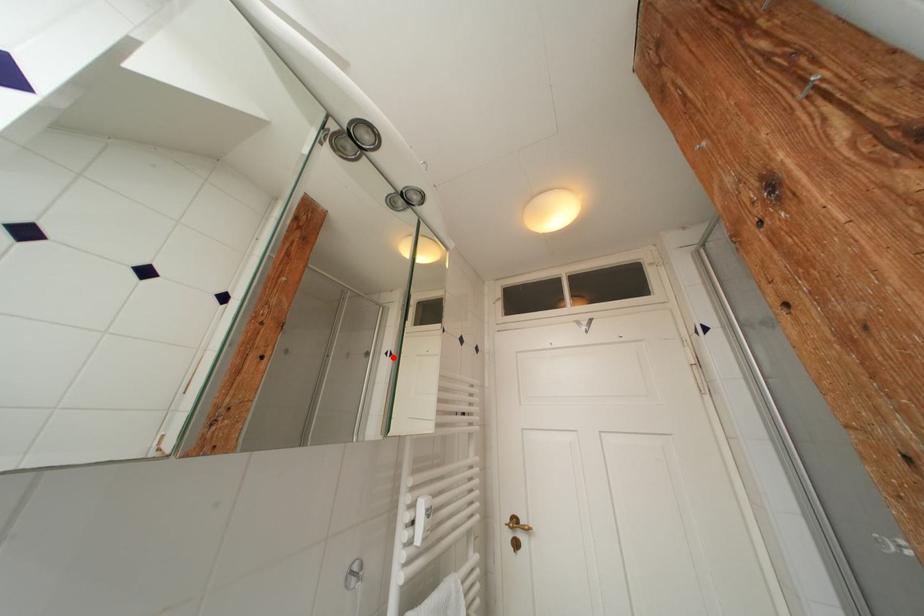
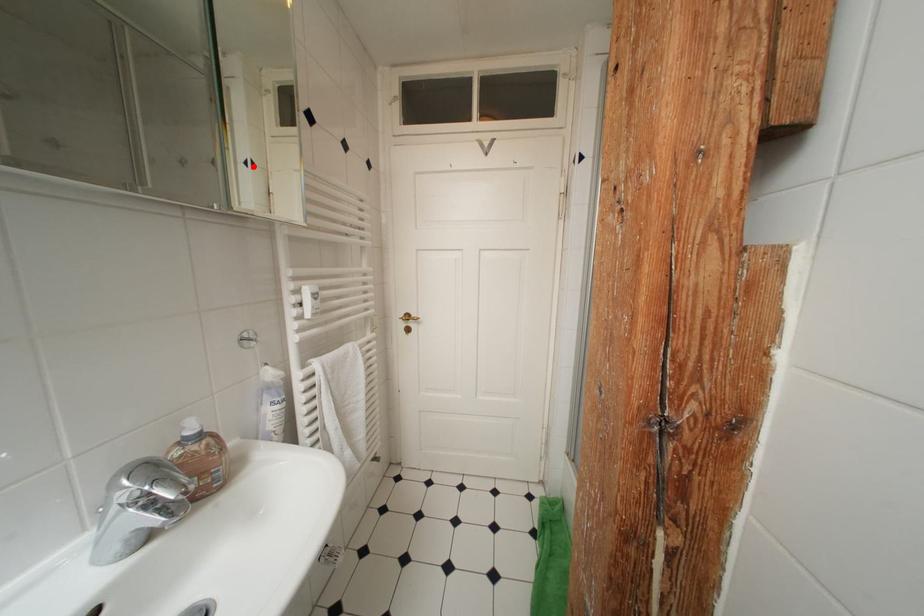
I am providing you with two images of the same scene from different viewpoints. A red point is marked on the first image and another point is marked on the second image. Are the points marked in image1 and image2 representing the same 3D position?

Yes